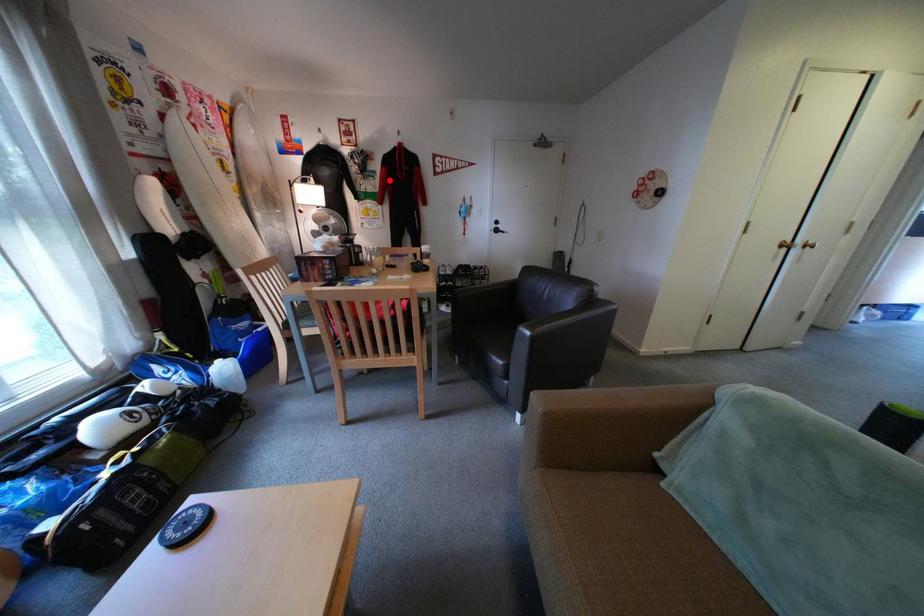
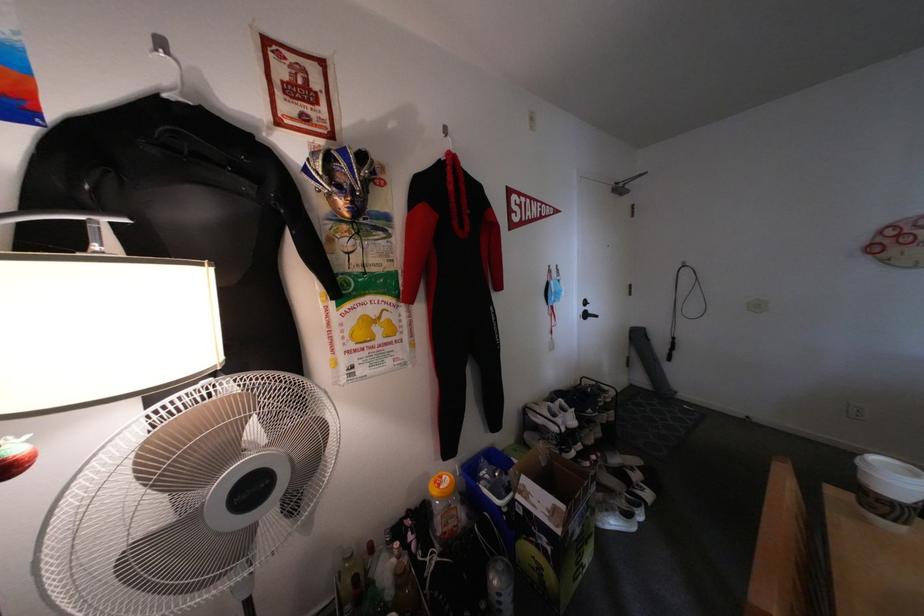
Find the pixel in the second image that matches the highlighted location in the first image.

(404, 237)